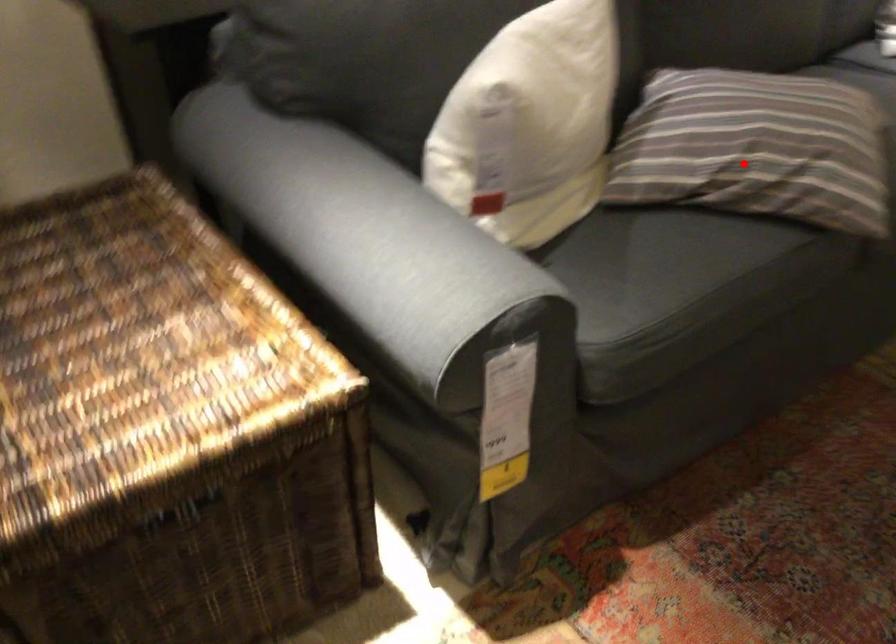
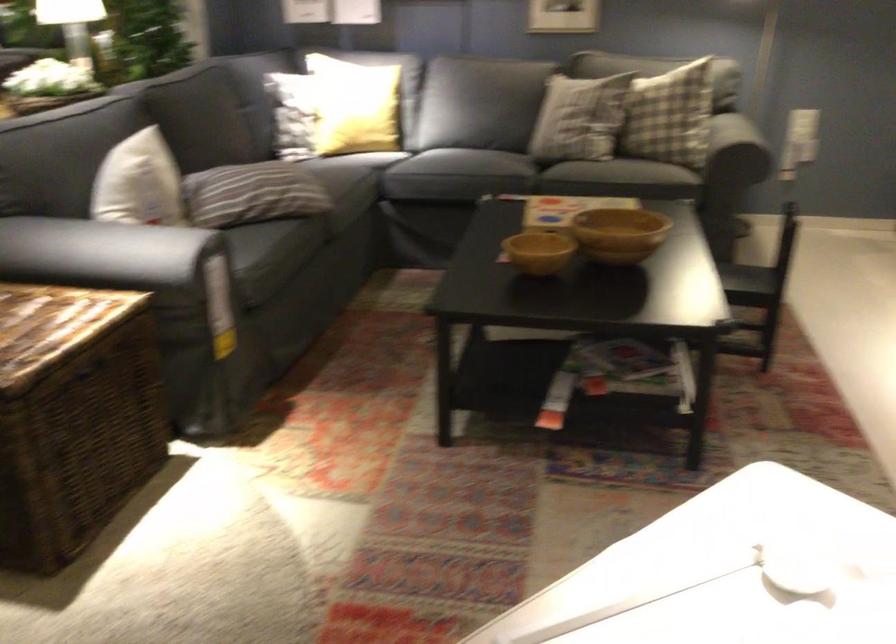
Question: I am providing you with two images of the same scene from different viewpoints. In image1, a red point is highlighted. Considering the same 3D point in image2, which of the following is correct?

Choices:
 (A) It is closer
 (B) It is farther

Answer: (B)